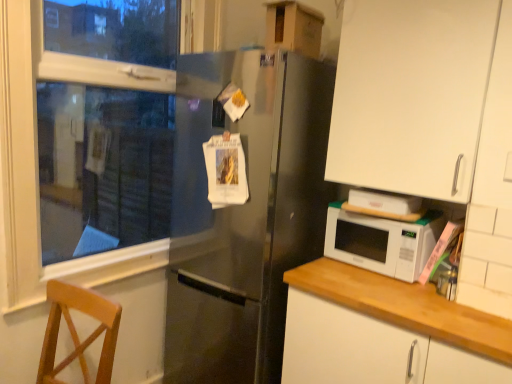
Question: From a real-world perspective, does white plastic window frame at left stand above white matte cabinet at right, the 2th cabinetry in the top-to-bottom sequence?

Choices:
 (A) no
 (B) yes

Answer: (B)

Question: Does white plastic window frame at left have a lesser width compared to white matte cabinet at right, which appears as the 1th cabinetry when ordered from the bottom?

Choices:
 (A) no
 (B) yes

Answer: (B)

Question: Does white plastic window frame at left come behind white matte cabinet at right, the 2th cabinetry in the top-to-bottom sequence?

Choices:
 (A) yes
 (B) no

Answer: (A)

Question: Is white plastic window frame at left smaller than white matte cabinet at right, the 2th cabinetry in the top-to-bottom sequence?

Choices:
 (A) no
 (B) yes

Answer: (B)

Question: Is white plastic window frame at left not inside white matte cabinet at right, the 2th cabinetry in the top-to-bottom sequence?

Choices:
 (A) no
 (B) yes

Answer: (B)

Question: From the image's perspective, is satin black refrigerator at center located above or below white plastic window frame at left?

Choices:
 (A) below
 (B) above

Answer: (A)

Question: Considering the positions of point (173, 243) and point (50, 56), is point (173, 243) closer or farther from the camera than point (50, 56)?

Choices:
 (A) farther
 (B) closer

Answer: (A)

Question: Would you say satin black refrigerator at center is to the left or to the right of white plastic window frame at left in the picture?

Choices:
 (A) left
 (B) right

Answer: (B)

Question: In terms of size, does satin black refrigerator at center appear bigger or smaller than white plastic window frame at left?

Choices:
 (A) big
 (B) small

Answer: (A)

Question: Does point (373, 86) appear closer or farther from the camera than point (365, 228)?

Choices:
 (A) closer
 (B) farther

Answer: (A)

Question: From the image's perspective, relative to white glossy microwave at lower right, is white matte cabinet at upper right, marked as the second cabinetry in a bottom-to-top arrangement, above or below?

Choices:
 (A) below
 (B) above

Answer: (B)

Question: From their relative heights in the image, would you say white matte cabinet at upper right, the first cabinetry from the top, is taller or shorter than white glossy microwave at lower right?

Choices:
 (A) tall
 (B) short

Answer: (A)

Question: Is white matte cabinet at upper right, marked as the second cabinetry in a bottom-to-top arrangement, in front of or behind white glossy microwave at lower right in the image?

Choices:
 (A) front
 (B) behind

Answer: (A)

Question: Is white matte cabinet at right, which appears as the 1th cabinetry when ordered from the bottom, taller or shorter than white glossy microwave at lower right?

Choices:
 (A) tall
 (B) short

Answer: (A)

Question: Is point (324, 362) closer or farther from the camera than point (346, 259)?

Choices:
 (A) closer
 (B) farther

Answer: (A)